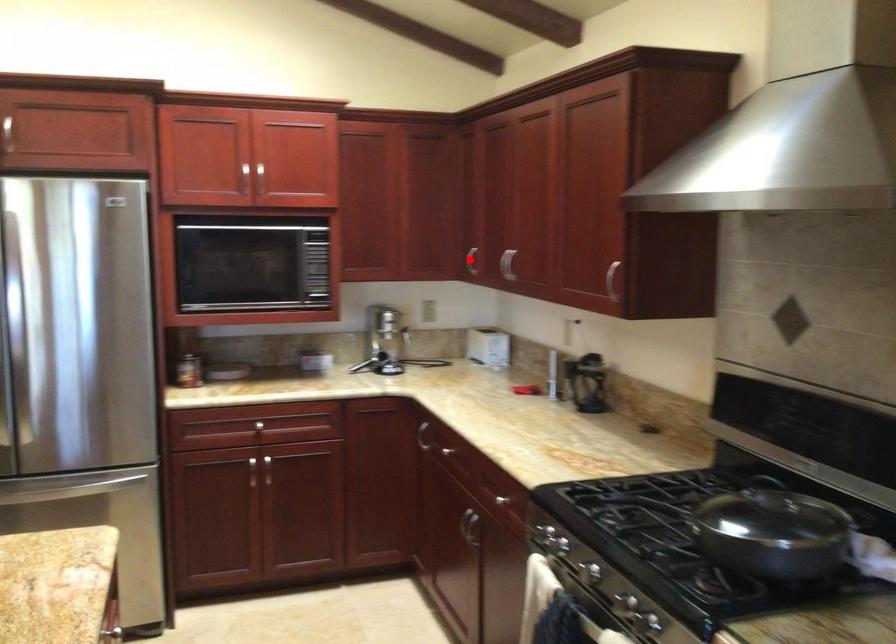
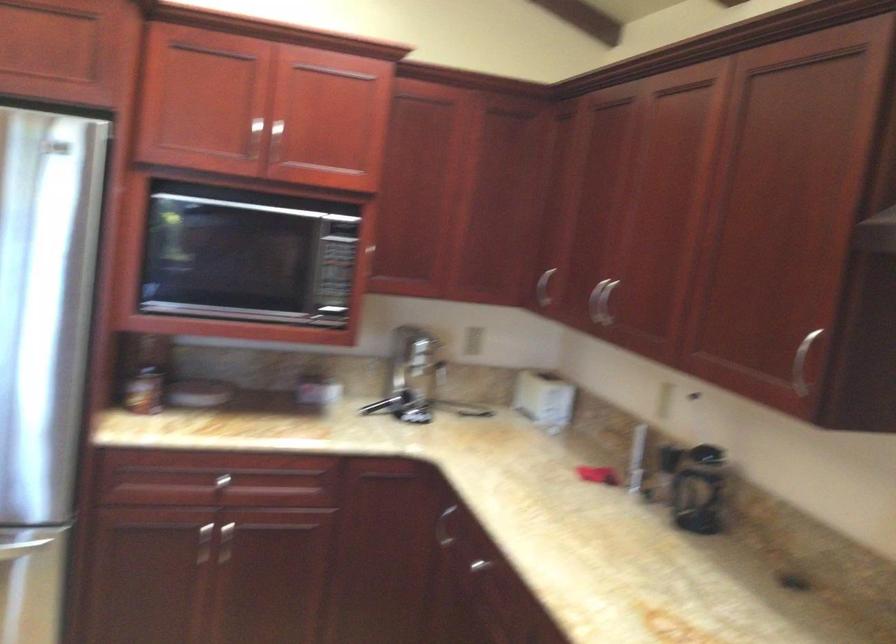
Question: I am providing you with two images of the same scene from different viewpoints. Given a red point in image1, look at the same physical point in image2. Is it:

Choices:
 (A) Closer to the viewpoint
 (B) Farther from the viewpoint

Answer: (A)